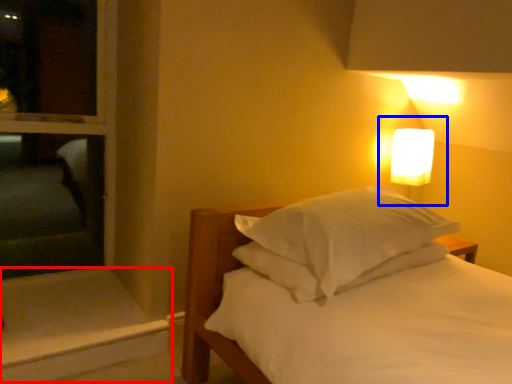
Question: Which of the following is the closest to the observer, window sill (highlighted by a red box) or bedside lamp (highlighted by a blue box)?

Choices:
 (A) window sill
 (B) bedside lamp

Answer: (A)